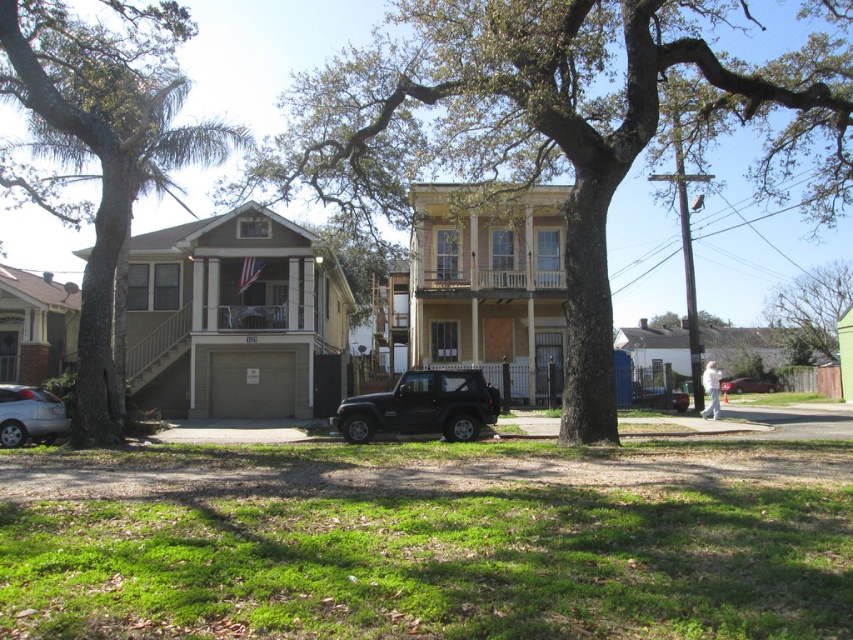
Can you confirm if black matte suv at center is bigger than metallic silver car at center?

Yes.

Who is positioned more to the left, black matte suv at center or metallic silver car at center?

Positioned to the left is black matte suv at center.

Does point (404, 401) come in front of point (674, 408)?

Yes, it is.

Locate an element on the screen. black matte suv at center is located at coordinates (422, 406).

Find the location of a particular element. brown textured tree at center is located at coordinates (560, 124).

Describe the element at coordinates (560, 124) in the screenshot. The height and width of the screenshot is (640, 853). I see `brown textured tree at center` at that location.

Which is behind, point (759, 179) or point (20, 422)?

The point (759, 179) is behind.

Find the location of a particular element. This screenshot has width=853, height=640. brown textured tree at center is located at coordinates (560, 124).

Locate an element on the screen. green leafy tree at upper right is located at coordinates (811, 310).

Between point (808, 296) and point (67, 417), which one is positioned behind?

Positioned behind is point (808, 296).

Which is in front, point (810, 355) or point (16, 417)?

Point (16, 417) is in front.

In order to click on green leafy tree at upper right in this screenshot , I will do `click(811, 310)`.